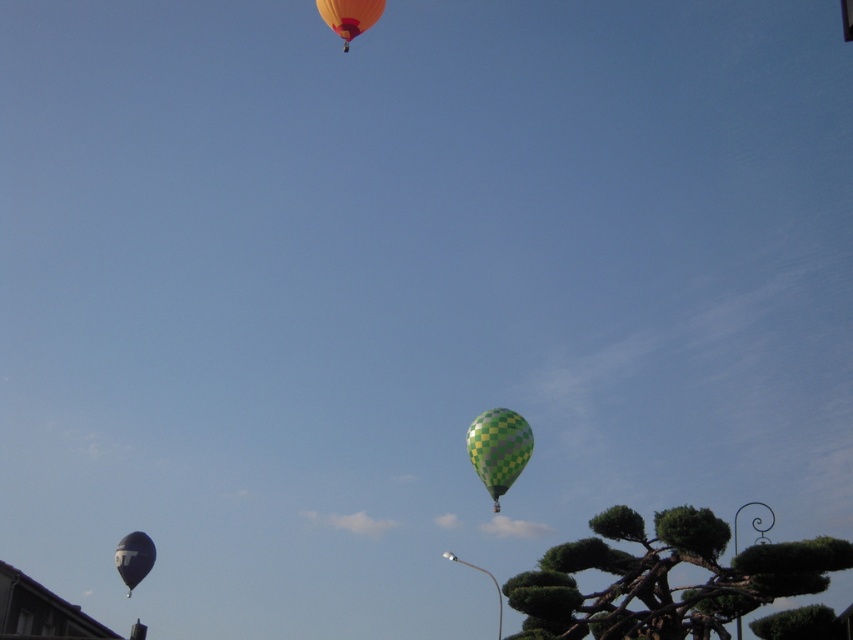
Question: Is green checkered tree at lower right above matte black balloon at lower left?

Choices:
 (A) no
 (B) yes

Answer: (B)

Question: Which of the following is the closest to the observer?

Choices:
 (A) matte black balloon at lower left
 (B) orange glossy balloon at upper center
 (C) green checkered balloon at center
 (D) green checkered tree at lower right

Answer: (D)

Question: Can you confirm if green checkered balloon at center is bigger than orange glossy balloon at upper center?

Choices:
 (A) yes
 (B) no

Answer: (A)

Question: Among these points, which one is farthest from the camera?

Choices:
 (A) (498, 442)
 (B) (119, 564)
 (C) (366, 20)
 (D) (833, 570)

Answer: (A)

Question: Which point is closer to the camera?

Choices:
 (A) green checkered balloon at center
 (B) orange glossy balloon at upper center

Answer: (B)

Question: Is green checkered tree at lower right above green checkered balloon at center?

Choices:
 (A) no
 (B) yes

Answer: (B)